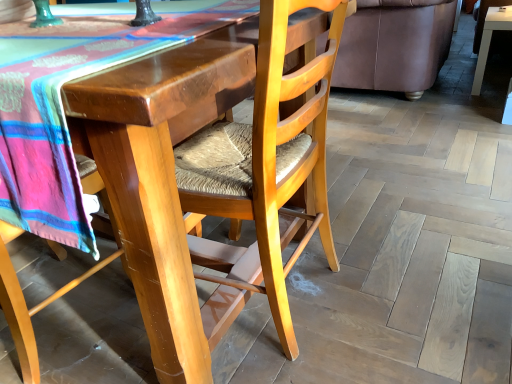
Question: From a real-world perspective, is brown leather couch at upper right physically located above or below wooden woven seat at center, arranged as the first chair when viewed from the left?

Choices:
 (A) below
 (B) above

Answer: (A)

Question: Is brown leather couch at upper right situated inside wooden woven seat at center, arranged as the first chair when viewed from the left, or outside?

Choices:
 (A) outside
 (B) inside

Answer: (A)

Question: Which object is the farthest from the brown leather couch at upper right?

Choices:
 (A) wooden woven seat at center, arranged as the first chair when viewed from the left
 (B) wooden woven seat at lower left, which appears as the first chair when viewed from the right
 (C) white glossy table at upper right

Answer: (A)

Question: Which object is positioned farthest from the wooden woven seat at center, arranged as the 2th chair when viewed from the right?

Choices:
 (A) wooden woven seat at lower left, which ranks as the second chair in left-to-right order
 (B) white glossy table at upper right
 (C) brown leather couch at upper right

Answer: (B)